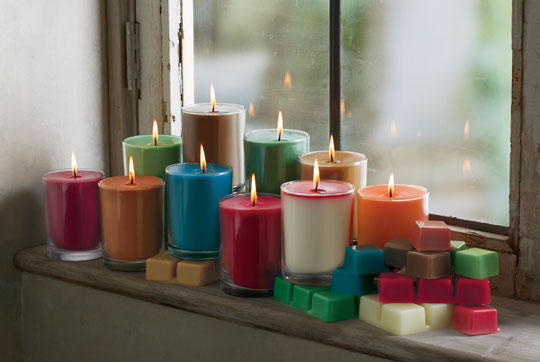
At what (x,y) coordinates should I click in order to perform the action: click on candles. Please return your answer as a coordinate pair (x, y). Looking at the image, I should click on (82, 210), (147, 216), (202, 213), (234, 235), (312, 232), (380, 218), (351, 173), (273, 168), (220, 139), (148, 160).